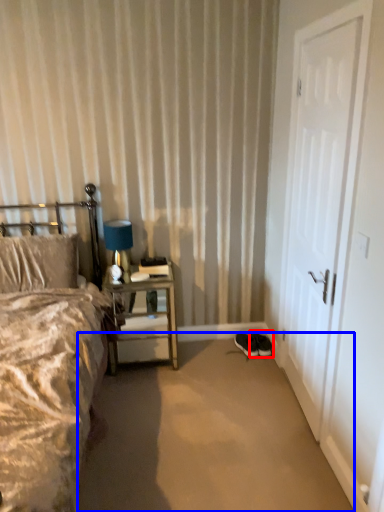
Question: Which point is further to the camera, footwear (highlighted by a red box) or plain (highlighted by a blue box)?

Choices:
 (A) footwear
 (B) plain

Answer: (A)